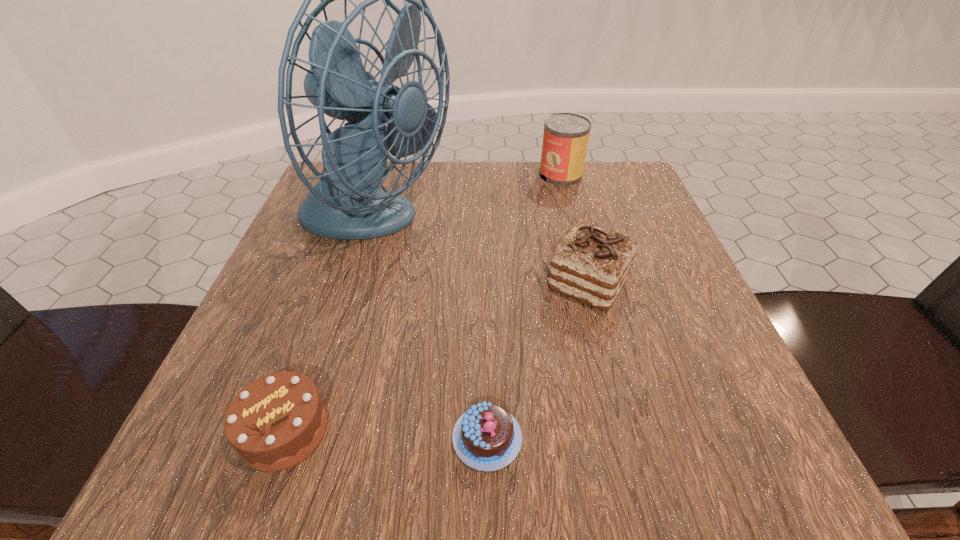
This screenshot has height=540, width=960. In order to click on object that is positioned at the near left corner in this screenshot , I will do point(275,422).

Where is `object that is positioned at the far right corner`? object that is positioned at the far right corner is located at coordinates (565, 139).

This screenshot has width=960, height=540. In the image, there is a desktop. Identify the location of vacant space at the far edge. (559, 196).

Image resolution: width=960 pixels, height=540 pixels. I want to click on free region at the near edge of the desktop, so click(323, 462).

This screenshot has height=540, width=960. What are the coordinates of `free region at the left edge of the desktop` in the screenshot? It's located at (318, 306).

This screenshot has width=960, height=540. Identify the location of free region at the right edge of the desktop. (637, 249).

In the image, there is a desktop. Where is `free region at the near left corner`? free region at the near left corner is located at coordinates (211, 480).

At what (x,y) coordinates should I click in order to perform the action: click on vacant area at the far right corner. Please return your answer as a coordinate pair (x, y). This screenshot has height=540, width=960. Looking at the image, I should click on (630, 185).

Locate an element on the screen. This screenshot has width=960, height=540. free location at the near right corner of the desktop is located at coordinates (x=767, y=460).

You are a GUI agent. You are given a task and a screenshot of the screen. Output one action in this format:
    pyautogui.click(x=<x>, y=<y>)
    Task: Click on the vacant space in between the fan and the fourth shortest object
    The image size is (960, 540).
    Given the screenshot: What is the action you would take?
    pyautogui.click(x=468, y=200)